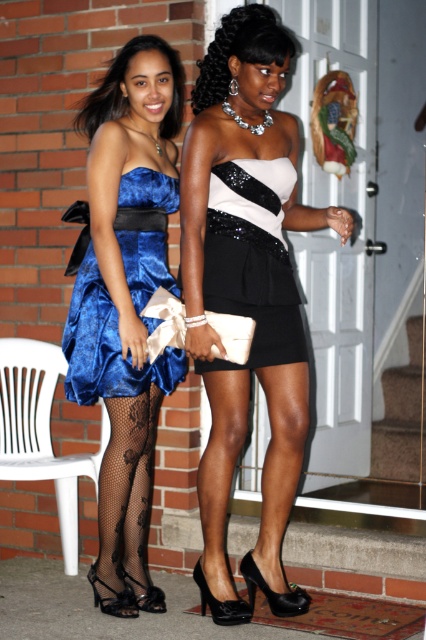
Question: Which point appears farthest from the camera in this image?

Choices:
 (A) (46, 444)
 (B) (244, 387)

Answer: (A)

Question: Which point is farther to the camera?

Choices:
 (A) (199, 118)
 (B) (29, 374)

Answer: (B)

Question: Where is black lace tights at lower left located in relation to white plastic chair at lower left in the image?

Choices:
 (A) above
 (B) below

Answer: (B)

Question: Considering the real-world distances, which object is farthest from the black patent leather high heels at lower center?

Choices:
 (A) shiny black dress at center
 (B) white plastic chair at lower left

Answer: (B)

Question: Considering the relative positions of velvet blue dress at left and black sequined dress at center in the image provided, where is velvet blue dress at left located with respect to black sequined dress at center?

Choices:
 (A) left
 (B) right

Answer: (A)

Question: Is satin dress at center below blue satin dress at left?

Choices:
 (A) yes
 (B) no

Answer: (B)